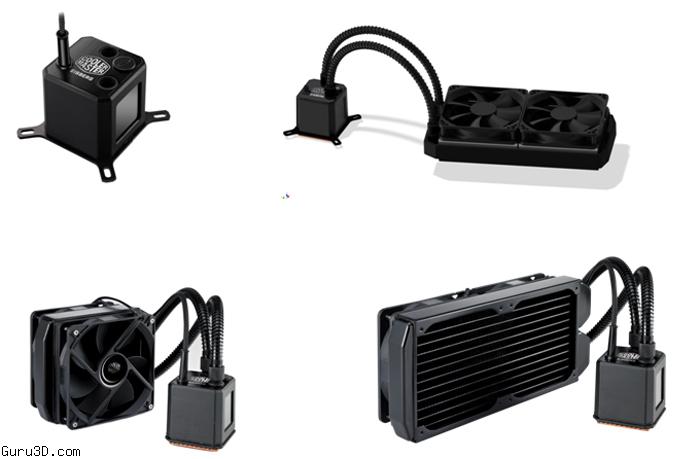
You are a GUI agent. You are given a task and a screenshot of the screen. Output one action in this format:
    pyautogui.click(x=<x>, y=<y>)
    Task: Click on the black cord
    The image size is (700, 459).
    Given the screenshot: What is the action you would take?
    pyautogui.click(x=612, y=290)